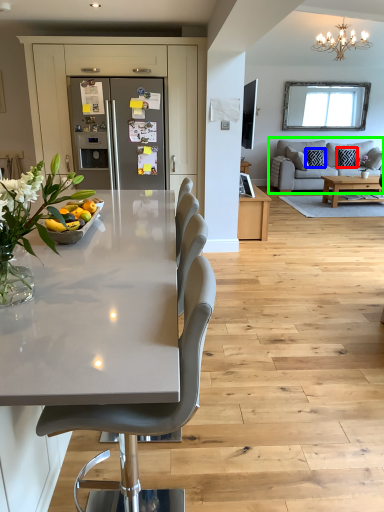
Question: Which object is the closest to the pillow (highlighted by a red box)? Choose among these: pillow (highlighted by a blue box) or studio couch (highlighted by a green box).

Choices:
 (A) pillow
 (B) studio couch

Answer: (A)